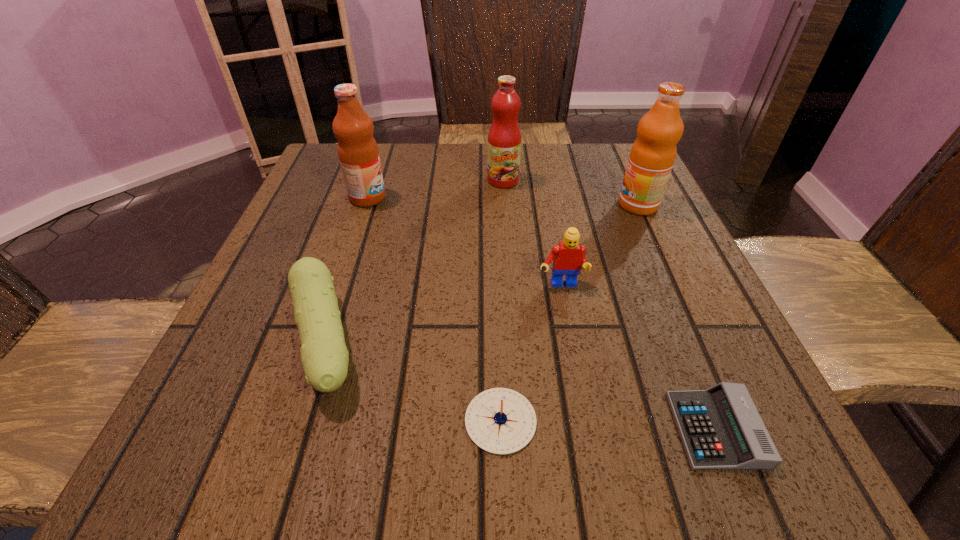
You are a GUI agent. You are given a task and a screenshot of the screen. Output one action in this format:
    pyautogui.click(x=<x>, y=<y>)
    Task: Click on the blank region between the rightmost fruit juice and the fifth tallest object
    
    Given the screenshot: What is the action you would take?
    pyautogui.click(x=482, y=274)

Where is `object that stands as the third closest to the cucumber`? Image resolution: width=960 pixels, height=540 pixels. object that stands as the third closest to the cucumber is located at coordinates (568, 256).

Identify which object is the second nearest to the sixth tallest object. Please provide its 2D coordinates. Your answer should be formatted as a tuple, i.e. [(x, y)], where the tuple contains the x and y coordinates of a point satisfying the conditions above.

[(721, 429)]

Identify which fruit juice is located as the nearest to the leftmost fruit juice. Please provide its 2D coordinates. Your answer should be formatted as a tuple, i.e. [(x, y)], where the tuple contains the x and y coordinates of a point satisfying the conditions above.

[(504, 138)]

Locate an element on the screen. This screenshot has width=960, height=540. fruit juice that stands as the second closest to the sixth tallest object is located at coordinates 358,153.

The image size is (960, 540). Find the location of `vacant space that satisfies the following two spatial constraints: 1. on the front-facing side of the calculator; 2. on the right side of the Lego`. vacant space that satisfies the following two spatial constraints: 1. on the front-facing side of the calculator; 2. on the right side of the Lego is located at coordinates (588, 429).

Where is `free location that satisfies the following two spatial constraints: 1. on the front label of the leftmost fruit juice; 2. on the left side of the calculator`? This screenshot has height=540, width=960. free location that satisfies the following two spatial constraints: 1. on the front label of the leftmost fruit juice; 2. on the left side of the calculator is located at coordinates (293, 429).

Identify the location of vacant space that satisfies the following two spatial constraints: 1. on the label side of the rightmost fruit juice; 2. on the front-facing side of the fourth tallest object. (674, 286).

The height and width of the screenshot is (540, 960). In order to click on free location that satisfies the following two spatial constraints: 1. on the front label of the calculator; 2. on the left side of the leftmost fruit juice in this screenshot , I will do `click(293, 429)`.

At what (x,y) coordinates should I click in order to perform the action: click on vacant space that satisfies the following two spatial constraints: 1. on the front label of the second fruit juice from right to left; 2. on the right side of the calculator. Please return your answer as a coordinate pair (x, y). Looking at the image, I should click on (520, 429).